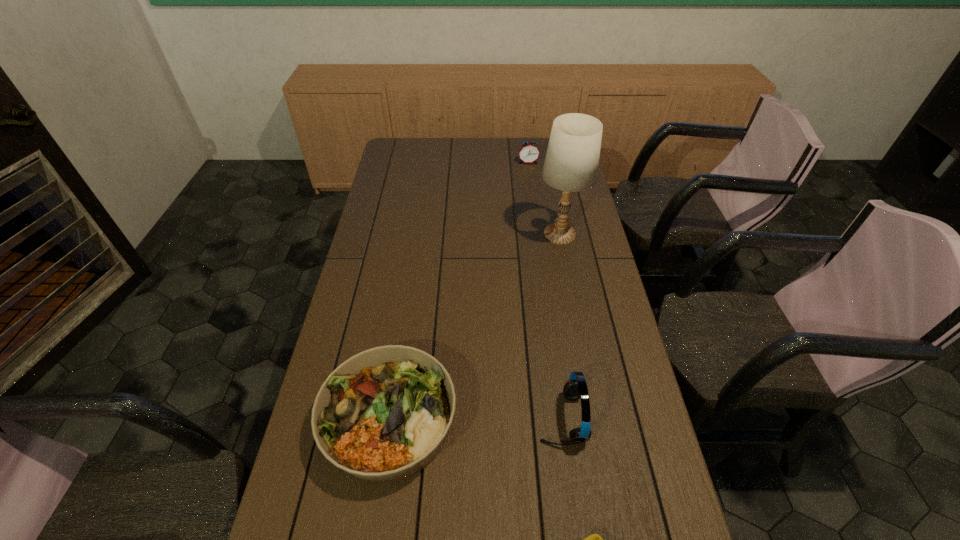
You are a GUI agent. You are given a task and a screenshot of the screen. Output one action in this format:
    pyautogui.click(x=<x>, y=<y>)
    Task: Click on the vacant area that satisfies the following two spatial constraints: 1. on the clock face of the lamp; 2. on the left side of the farthest object
    
    Given the screenshot: What is the action you would take?
    pyautogui.click(x=539, y=234)

Locate an element on the screen. free location that satisfies the following two spatial constraints: 1. on the clock face of the alarm clock; 2. with the microphone attached to the side of the second tallest object is located at coordinates (564, 418).